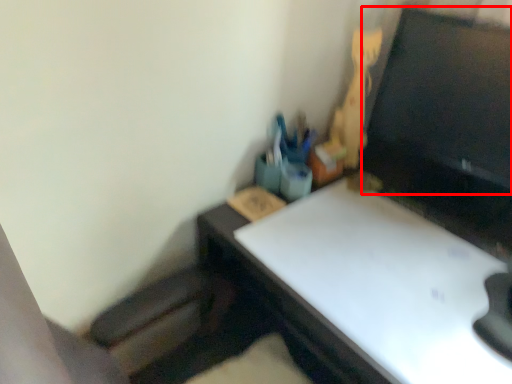
Question: From the image's perspective, considering the relative positions of computer monitor (annotated by the red box) and toy in the image provided, where is computer monitor (annotated by the red box) located with respect to the staircase?

Choices:
 (A) above
 (B) below

Answer: (A)